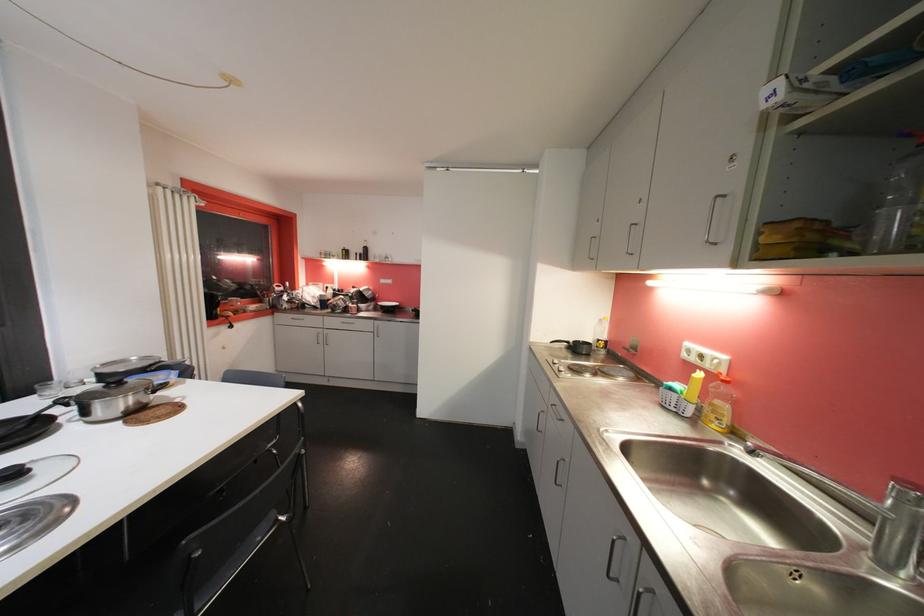
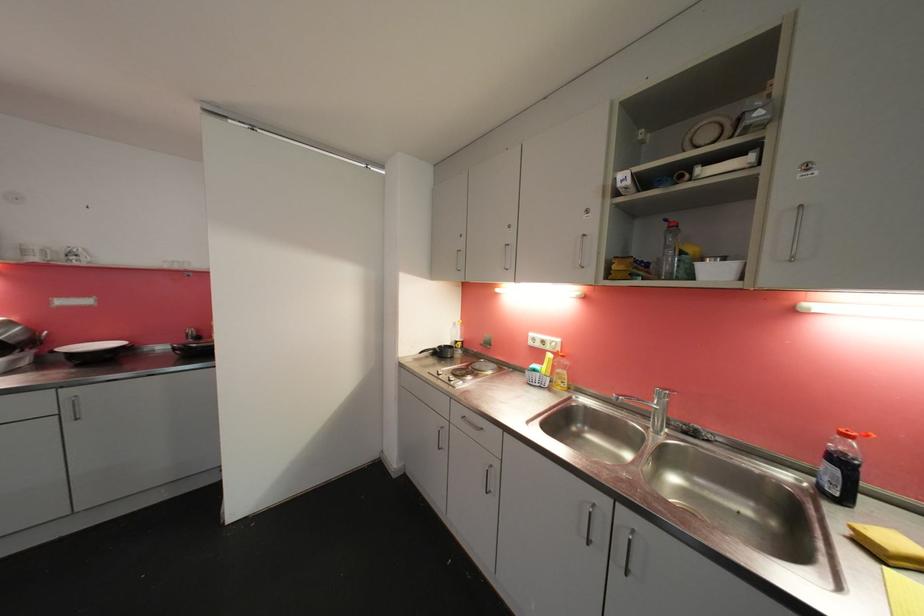
Locate, in the second image, the point that corresponds to the point at 704,378 in the first image.

(554, 358)